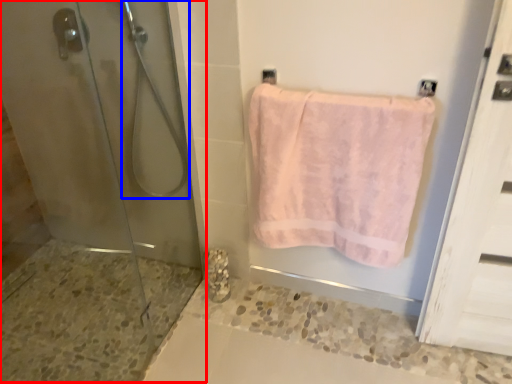
Question: Which of the following is the closest to the observer, shower door (highlighted by a red box) or shower (highlighted by a blue box)?

Choices:
 (A) shower door
 (B) shower

Answer: (A)